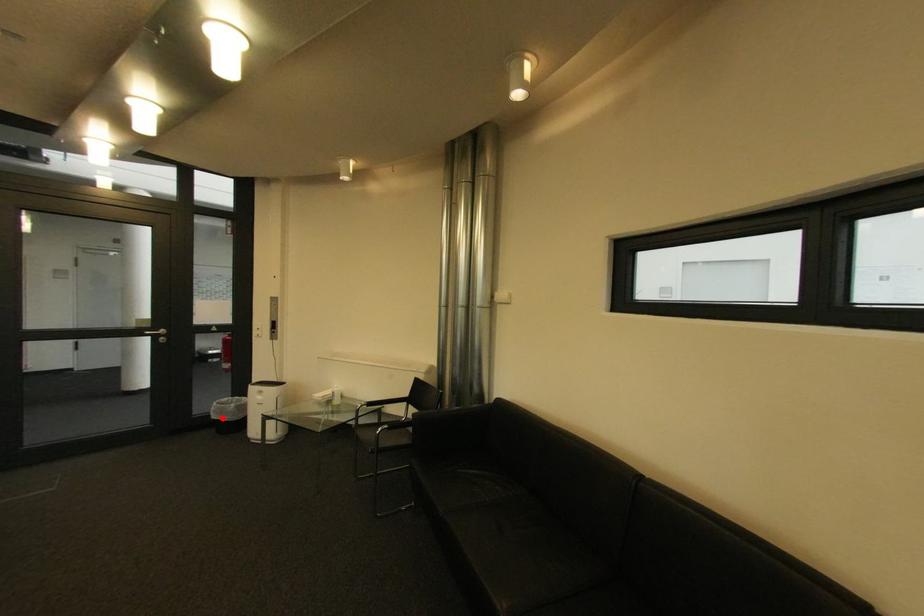
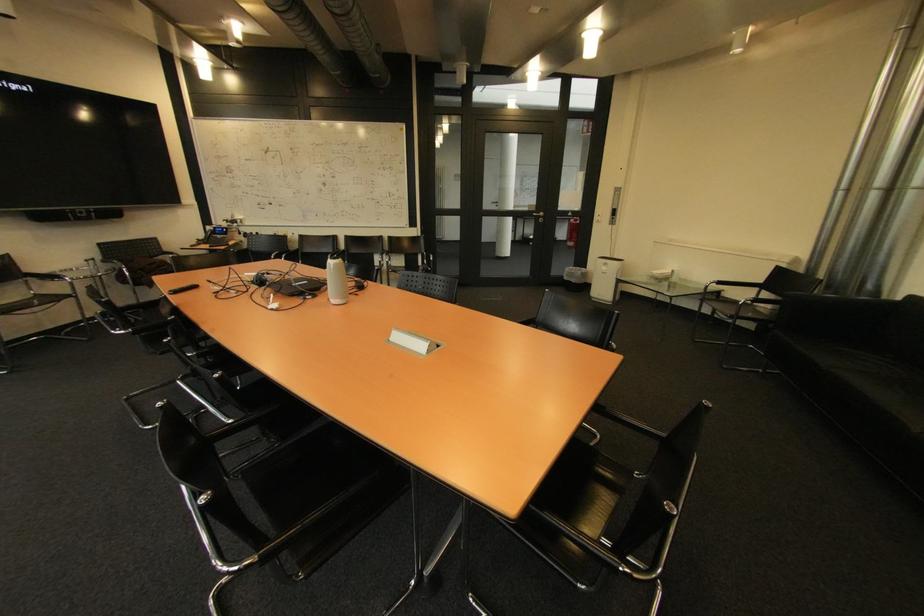
Question: I am providing you with two images of the same scene from different viewpoints. A red point is shown in image1. For the corresponding object point in image2, is it positioned nearer or farther from the camera?

Choices:
 (A) Nearer
 (B) Farther

Answer: (A)